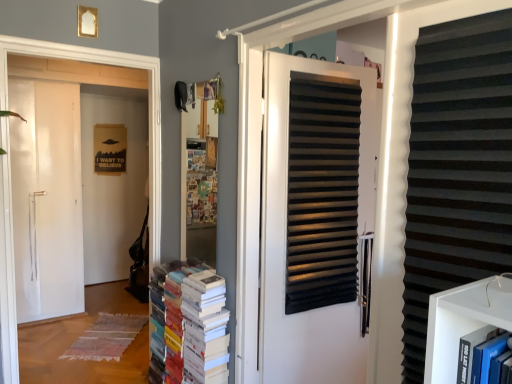
What do you see at coordinates (314, 218) in the screenshot? I see `white matte door at center` at bounding box center [314, 218].

Measure the distance between point (7, 361) and camera.

The distance of point (7, 361) from camera is 2.30 meters.

Image resolution: width=512 pixels, height=384 pixels. Describe the element at coordinates (106, 64) in the screenshot. I see `white matte door at left` at that location.

Where is `multicolored paper books at center`? multicolored paper books at center is located at coordinates (193, 322).

Consider the image. Does white matte door at center appear on the left side of black corrugated plastic at right?

Yes.

Is white matte door at center oriented away from black corrugated plastic at right?

white matte door at center does not have its back to black corrugated plastic at right.

Based on the photo, from a real-world perspective, who is located lower, white matte door at center or black corrugated plastic at right?

In real-world perspective, white matte door at center is lower.

Locate an element on the screen. The image size is (512, 384). door below the black corrugated plastic at right (from a real-world perspective) is located at coordinates (314, 218).

Which point is more forward, (293, 224) or (183, 266)?

The point (293, 224) is closer.

Is white matte door at center at the right side of multicolored paper books at center?

Correct, you'll find white matte door at center to the right of multicolored paper books at center.

How many degrees apart are the facing directions of white matte door at center and multicolored paper books at center?

There is a 10.2-degree angle between the facing directions of white matte door at center and multicolored paper books at center.

From the image's perspective, which is above, white matte door at center or multicolored paper books at center?

white matte door at center is shown above in the image.

Does black corrugated plastic at right appear on the left side of multicolored paper books at center?

No, black corrugated plastic at right is not to the left of multicolored paper books at center.

Can you confirm if black corrugated plastic at right is bigger than multicolored paper books at center?

No.

Is black corrugated plastic at right in front of or behind multicolored paper books at center in the image?

black corrugated plastic at right is positioned closer to the viewer than multicolored paper books at center.

Is point (505, 142) closer or farther from the camera than point (189, 279)?

Point (505, 142).

From a real-world perspective, is white matte door at center beneath white matte door at left?

Yes, from a real-world perspective, white matte door at center is under white matte door at left.

Considering the sizes of objects white matte door at center and white matte door at left in the image provided, who is shorter, white matte door at center or white matte door at left?

white matte door at center.

Is white matte door at center positioned far away from white matte door at left?

Yes, white matte door at center and white matte door at left are located far from each other.

From the image's perspective, between white matte door at center and white matte door at left, who is located below?

From the image's view, white matte door at center is below.

From the image's perspective, is multicolored paper books at center on white matte door at left?

Incorrect, from the image's perspective, multicolored paper books at center is lower than white matte door at left.

Between multicolored paper books at center and white matte door at left, which one has smaller size?

multicolored paper books at center.

You are a GUI agent. You are given a task and a screenshot of the screen. Output one action in this format:
    pyautogui.click(x=<x>, y=<y>)
    Task: Click on the book that is below the white matte door at left (from the image's perspective)
    This screenshot has width=512, height=384.
    Given the screenshot: What is the action you would take?
    pyautogui.click(x=193, y=322)

Is multicolored paper books at center aimed at white matte door at left?

No, multicolored paper books at center is not turned towards white matte door at left.

I want to click on door below the black corrugated plastic at right (from the image's perspective), so click(314, 218).

Could you tell me if black corrugated plastic at right is turned towards white matte door at center?

No, black corrugated plastic at right is not facing towards white matte door at center.

Is black corrugated plastic at right spatially inside white matte door at center, or outside of it?

black corrugated plastic at right lies outside white matte door at center.

Considering the positions of objects black corrugated plastic at right and white matte door at center in the image provided, who is more to the left, black corrugated plastic at right or white matte door at center?

From the viewer's perspective, white matte door at center appears more on the left side.

Does multicolored paper books at center come behind black corrugated plastic at right?

Yes.

Is multicolored paper books at center taller or shorter than black corrugated plastic at right?

Clearly, multicolored paper books at center is shorter compared to black corrugated plastic at right.

Considering the sizes of objects multicolored paper books at center and black corrugated plastic at right in the image provided, who is bigger, multicolored paper books at center or black corrugated plastic at right?

Bigger between the two is multicolored paper books at center.

Considering the positions of objects multicolored paper books at center and black corrugated plastic at right in the image provided, who is more to the left, multicolored paper books at center or black corrugated plastic at right?

From the viewer's perspective, multicolored paper books at center appears more on the left side.

Find the location of `shutter lying above the white matte door at center (from the image's perspective)`. shutter lying above the white matte door at center (from the image's perspective) is located at coordinates (457, 168).

This screenshot has width=512, height=384. I want to click on book that appears on the left of white matte door at center, so click(193, 322).

Based on their spatial positions, is black corrugated plastic at right or multicolored paper books at center closer to white matte door at left?

multicolored paper books at center.

Looking at the image, which one is located closer to multicolored paper books at center, white matte door at center or black corrugated plastic at right?

white matte door at center is positioned closer to the anchor multicolored paper books at center.

When comparing their distances from white matte door at left, does multicolored paper books at center or white matte door at center seem closer?

multicolored paper books at center lies closer to white matte door at left than the other object.

Considering their positions, is white matte door at left positioned further to black corrugated plastic at right than multicolored paper books at center?

white matte door at left.

From the image, which object appears to be nearer to multicolored paper books at center, black corrugated plastic at right or white matte door at left?

The object closer to multicolored paper books at center is white matte door at left.

Which object lies nearer to the anchor point multicolored paper books at center, white matte door at center or white matte door at left?

white matte door at center.

Based on the photo, estimate the real-world distances between objects in this image. Which object is further from black corrugated plastic at right, white matte door at left or white matte door at center?

The object further to black corrugated plastic at right is white matte door at left.

When comparing their distances from white matte door at center, does black corrugated plastic at right or multicolored paper books at center seem closer?

Among the two, multicolored paper books at center is located nearer to white matte door at center.

Locate an element on the screen. The image size is (512, 384). book between white matte door at center and white matte door at left in the front-back direction is located at coordinates (193, 322).

Locate an element on the screen. This screenshot has width=512, height=384. book between black corrugated plastic at right and white matte door at left from front to back is located at coordinates (193, 322).

Find the location of `door between black corrugated plastic at right and white matte door at left in the front-back direction`. door between black corrugated plastic at right and white matte door at left in the front-back direction is located at coordinates (314, 218).

Where is `door located between multicolored paper books at center and black corrugated plastic at right in the left-right direction`? This screenshot has height=384, width=512. door located between multicolored paper books at center and black corrugated plastic at right in the left-right direction is located at coordinates (314, 218).